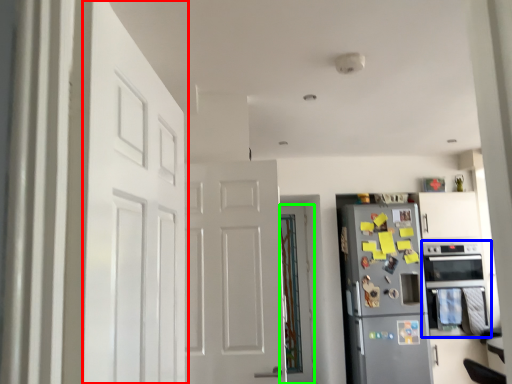
Question: Estimate the real-world distances between objects in this image. Which object is closer to door (highlighted by a red box), oven (highlighted by a blue box) or door (highlighted by a green box)?

Choices:
 (A) oven
 (B) door

Answer: (B)